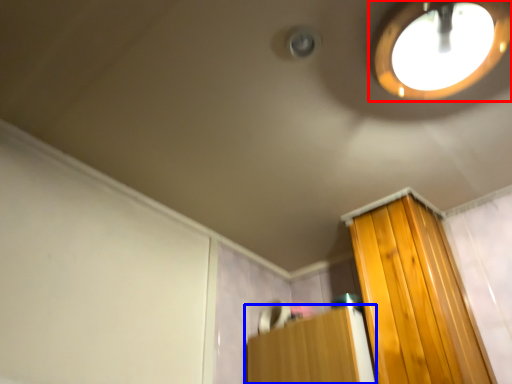
Question: Which object is closer to the camera taking this photo, droplight (highlighted by a red box) or furniture (highlighted by a blue box)?

Choices:
 (A) droplight
 (B) furniture

Answer: (A)